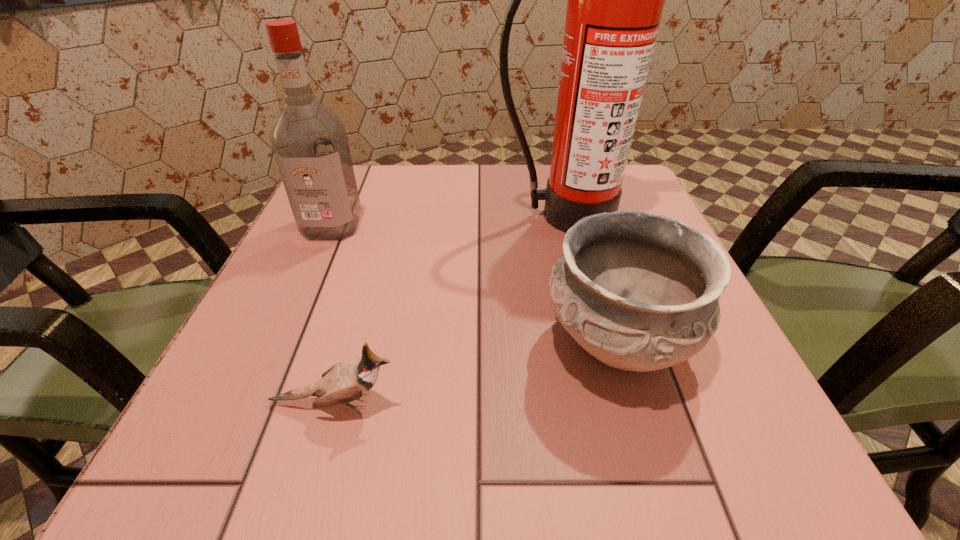
Find the location of a particular element. fire extinguisher is located at coordinates (615, 2).

Locate an element on the screen. Image resolution: width=960 pixels, height=540 pixels. the second tallest object is located at coordinates (309, 141).

Locate an element on the screen. The image size is (960, 540). pottery is located at coordinates (640, 292).

I want to click on bird, so click(x=344, y=382).

Where is `blank area located on the front-facing side of the fire extinguisher`? blank area located on the front-facing side of the fire extinguisher is located at coordinates (602, 362).

The height and width of the screenshot is (540, 960). Find the location of `free location located on the front-facing side of the second tallest object`. free location located on the front-facing side of the second tallest object is located at coordinates (272, 363).

Identify the location of vacant area located 0.060m on the left of the third tallest object. The width and height of the screenshot is (960, 540). (502, 342).

Identify the location of free space located at the face of the bird. (550, 403).

The height and width of the screenshot is (540, 960). In order to click on fire extinguisher that is at the far edge in this screenshot , I will do `click(615, 2)`.

You are a GUI agent. You are given a task and a screenshot of the screen. Output one action in this format:
    pyautogui.click(x=<x>, y=<y>)
    Task: Click on the liquor at the far edge
    The height and width of the screenshot is (540, 960).
    Given the screenshot: What is the action you would take?
    pyautogui.click(x=309, y=141)